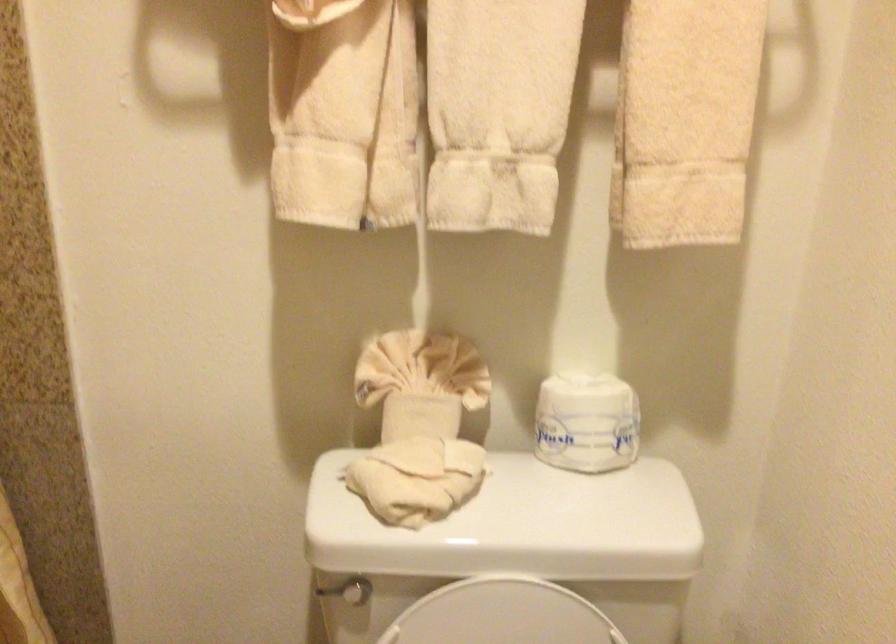
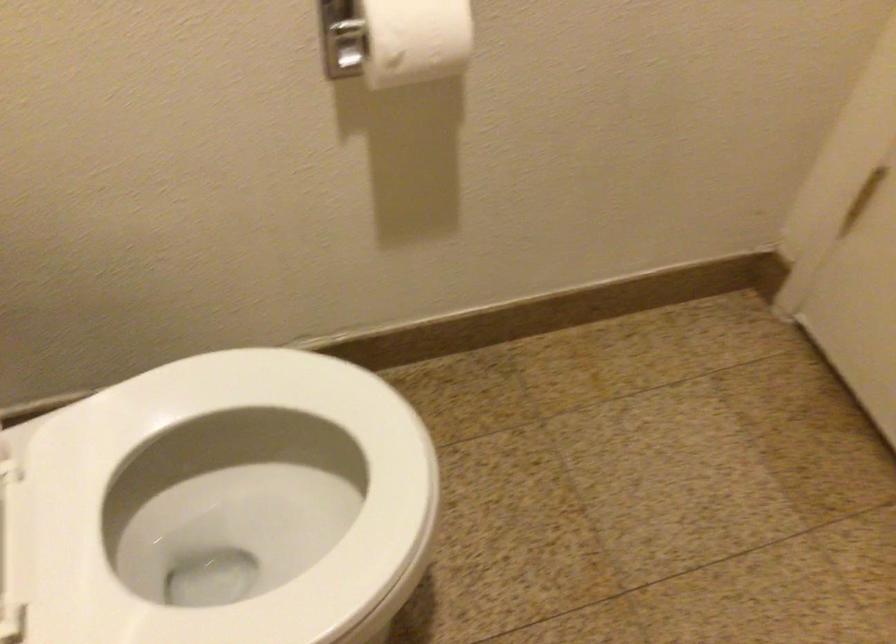
First-person continuous shooting, in which direction is the camera rotating?

The camera's rotation is toward right-down.